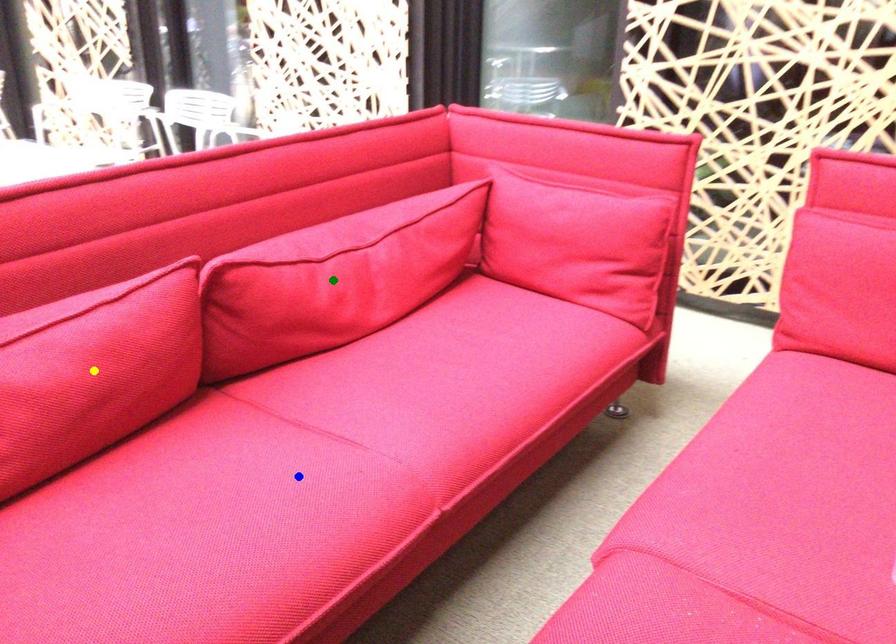
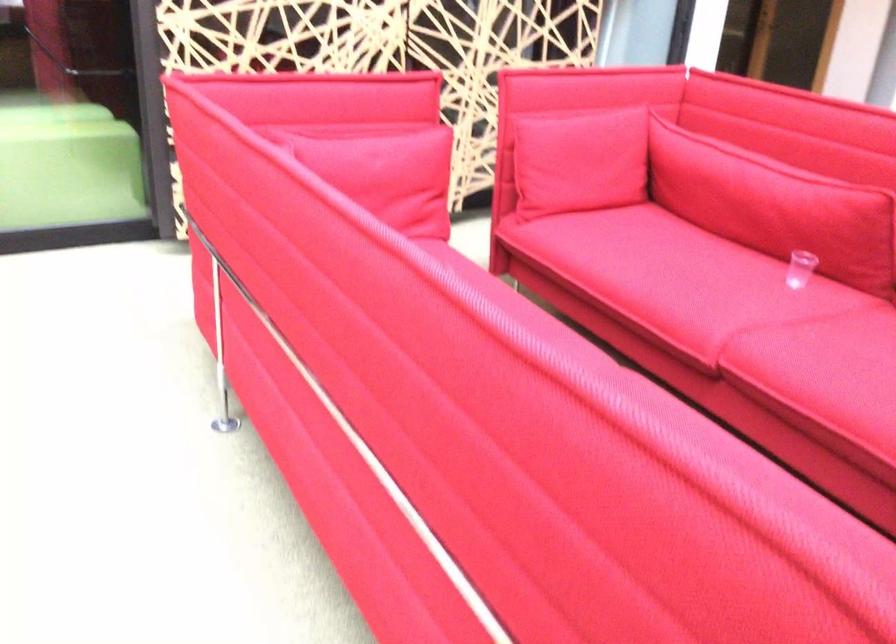
I am providing you with two images of the same scene from different viewpoints. Three points are marked in image1. Which point corresponds to a part or object that is occluded in image2?In image1, three points are marked. Which of them correspond to a part or object that is occluded in image2?Among the three points shown in image1, which one corresponds to a part or object that is no longer visible due to occlusion in image2?

green point, yellow point, blue point